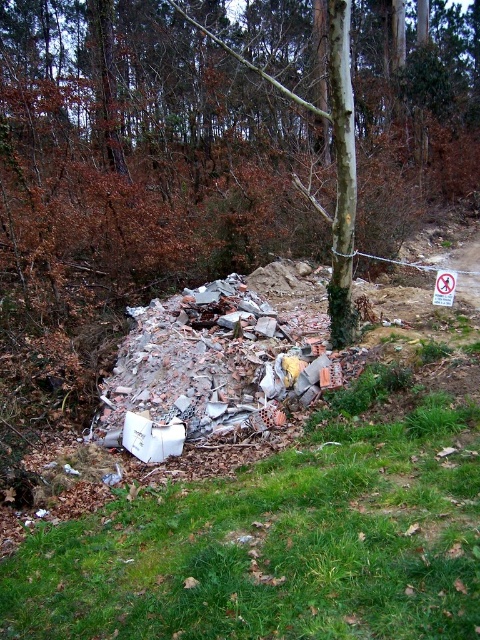
Question: Among these points, which one is farthest from the camera?

Choices:
 (A) (357, 204)
 (B) (241, 481)

Answer: (A)

Question: Which point is closer to the camera?

Choices:
 (A) green grass at lower center
 (B) green bark tree at center

Answer: (A)

Question: Can you confirm if green bark tree at center is positioned to the right of green grass at lower center?

Choices:
 (A) yes
 (B) no

Answer: (B)

Question: Which point is farther to the camera?

Choices:
 (A) green bark tree at center
 (B) green grass at lower center

Answer: (A)

Question: From the image, what is the correct spatial relationship of green bark tree at center in relation to green grass at lower center?

Choices:
 (A) left
 (B) right

Answer: (A)

Question: Is green bark tree at center wider than green grass at lower center?

Choices:
 (A) no
 (B) yes

Answer: (B)